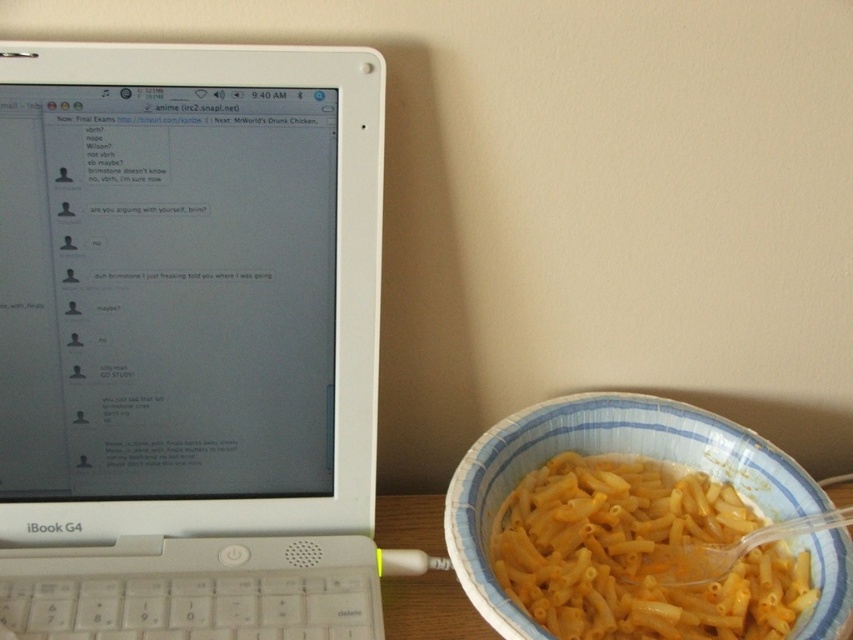
You are organizing a study session and need to place a notebook between the white plastic laptop at left and the yellow matte pasta at right. Based on their positions, where should you place the notebook?

Since the white plastic laptop at left is located above the yellow matte pasta at right, you should place the notebook below the white plastic laptop at left and above the yellow matte pasta at right to position it between them.

You are organizing a study session and need to place a notebook between the white plastic laptop at left and the yellow matte pasta at right. Based on their heights, which object should the notebook be placed closer to?

The white plastic laptop at left is much taller than the yellow matte pasta at right, so the notebook should be placed closer to the yellow matte pasta at right to ensure stability.

You are organizing a desk and need to place the white plastic laptop at left and the yellow matte pasta at right. If you want to arrange them side by side with equal spacing between them and the edges of the desk, which object should be placed closer to the center of the desk?

The white plastic laptop at left should be placed closer to the center of the desk because its width is larger than the yellow matte pasta at right, so to maintain equal spacing, the wider object needs to be centered more towards the middle to balance the arrangement.